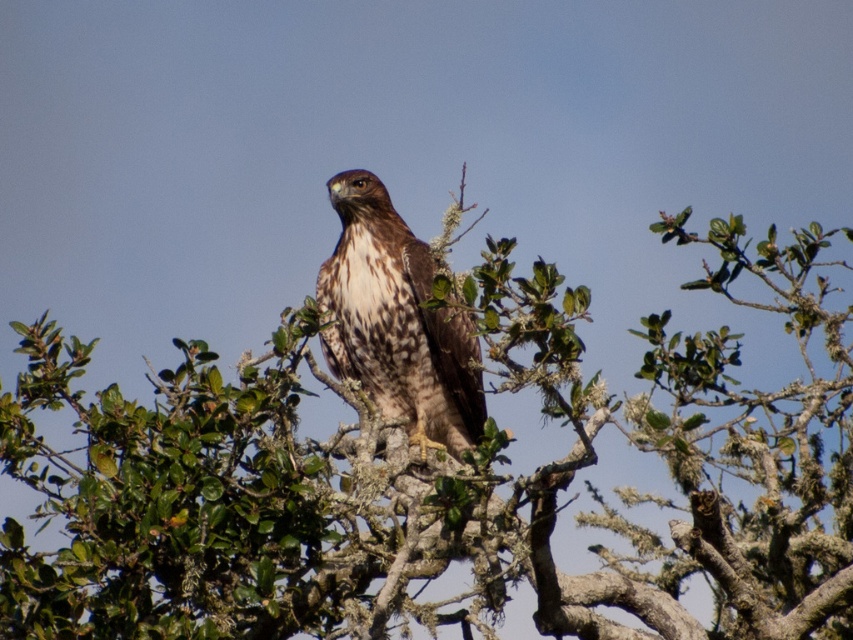
Question: From the image, what is the correct spatial relationship of green leafy tree at center in relation to brown speckled eagle at center?

Choices:
 (A) left
 (B) right

Answer: (B)

Question: In this image, where is green leafy tree at center located relative to brown speckled eagle at center?

Choices:
 (A) below
 (B) above

Answer: (A)

Question: Does green leafy tree at center have a smaller size compared to brown speckled eagle at center?

Choices:
 (A) no
 (B) yes

Answer: (A)

Question: Among these points, which one is nearest to the camera?

Choices:
 (A) (831, 625)
 (B) (363, 257)

Answer: (A)

Question: Which point is farther to the camera?

Choices:
 (A) green leafy tree at center
 (B) brown speckled eagle at center

Answer: (B)

Question: Which point appears farthest from the camera in this image?

Choices:
 (A) (372, 208)
 (B) (167, 620)

Answer: (A)